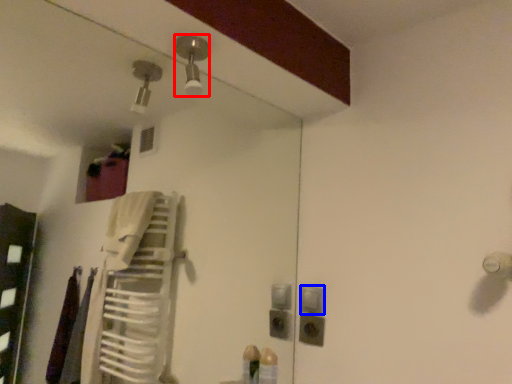
Question: Which object is further to the camera taking this photo, light fixture (highlighted by a red box) or light switch (highlighted by a blue box)?

Choices:
 (A) light fixture
 (B) light switch

Answer: (B)